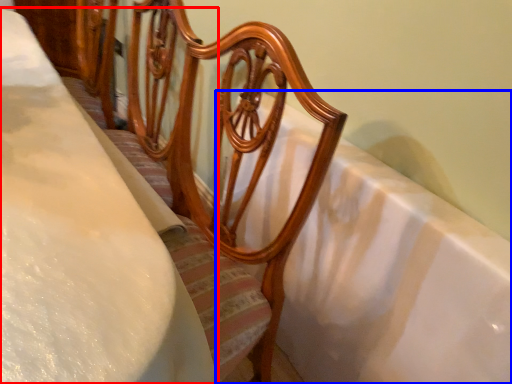
Question: Among these objects, which one is nearest to the camera, sheet (highlighted by a red box) or bath (highlighted by a blue box)?

Choices:
 (A) sheet
 (B) bath

Answer: (A)